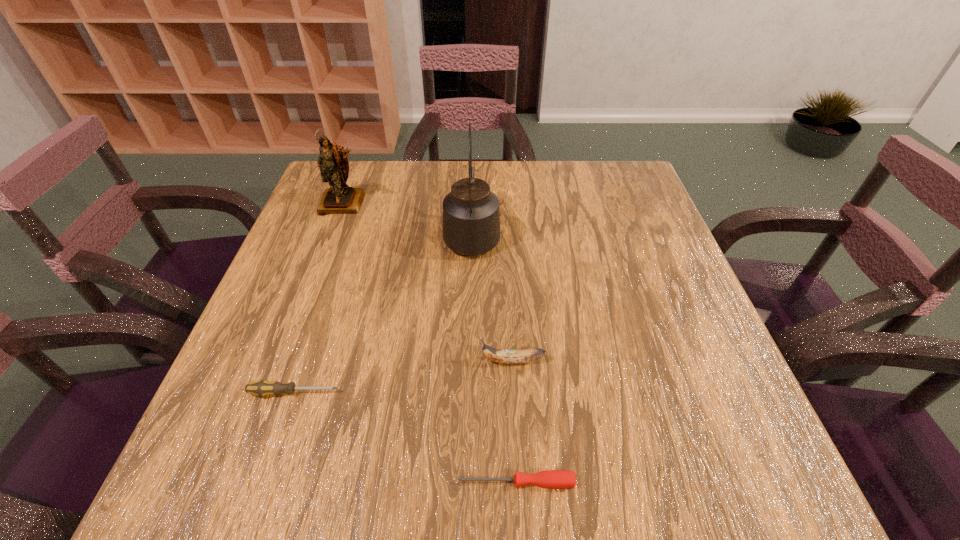
Where is `free space located spout on the kettle`? free space located spout on the kettle is located at coordinates (473, 170).

Locate an element on the screen. free space located 0.230m on the front-facing side of the fourth shortest object is located at coordinates (315, 279).

The width and height of the screenshot is (960, 540). Find the location of `blank space located at the stem of the banana`. blank space located at the stem of the banana is located at coordinates (405, 361).

Locate an element on the screen. The width and height of the screenshot is (960, 540). free space located at the stem of the banana is located at coordinates (389, 361).

Locate an element on the screen. free spot located at the stem of the banana is located at coordinates (319, 361).

Image resolution: width=960 pixels, height=540 pixels. I want to click on free space located 0.290m at the tip of the farther screwdriver, so click(505, 393).

You are a GUI agent. You are given a task and a screenshot of the screen. Output one action in this format:
    pyautogui.click(x=<x>, y=<y>)
    Task: Click on the vacant space located 0.350m at the tip of the shortest object
    The image size is (960, 540).
    Given the screenshot: What is the action you would take?
    pyautogui.click(x=228, y=482)

Locate an element on the screen. This screenshot has width=960, height=540. free region located 0.220m at the tip of the shortest object is located at coordinates (313, 482).

Where is `vacant space positioned at the tip of the shortest object`? The image size is (960, 540). vacant space positioned at the tip of the shortest object is located at coordinates (194, 482).

Find the location of a particular element. object that is at the far edge is located at coordinates (334, 167).